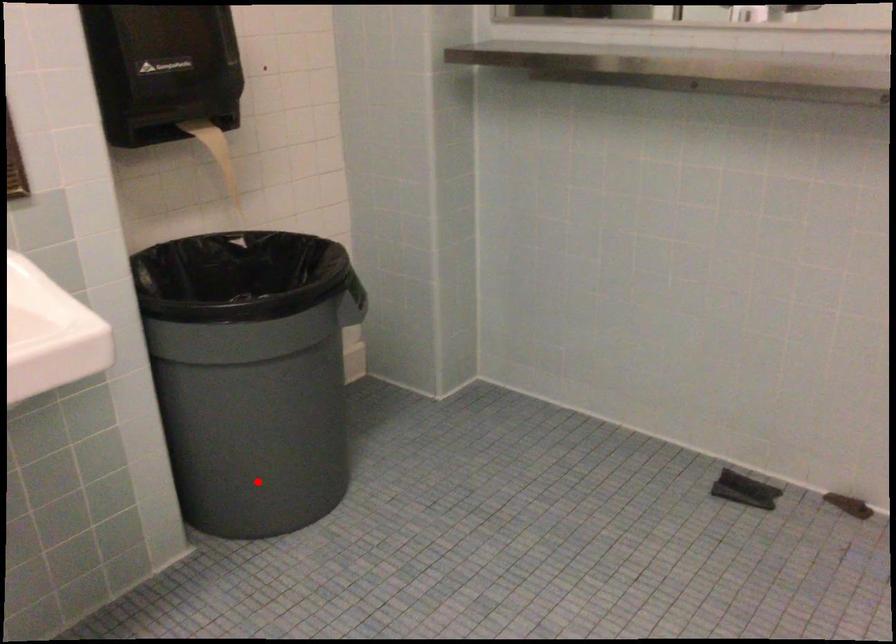
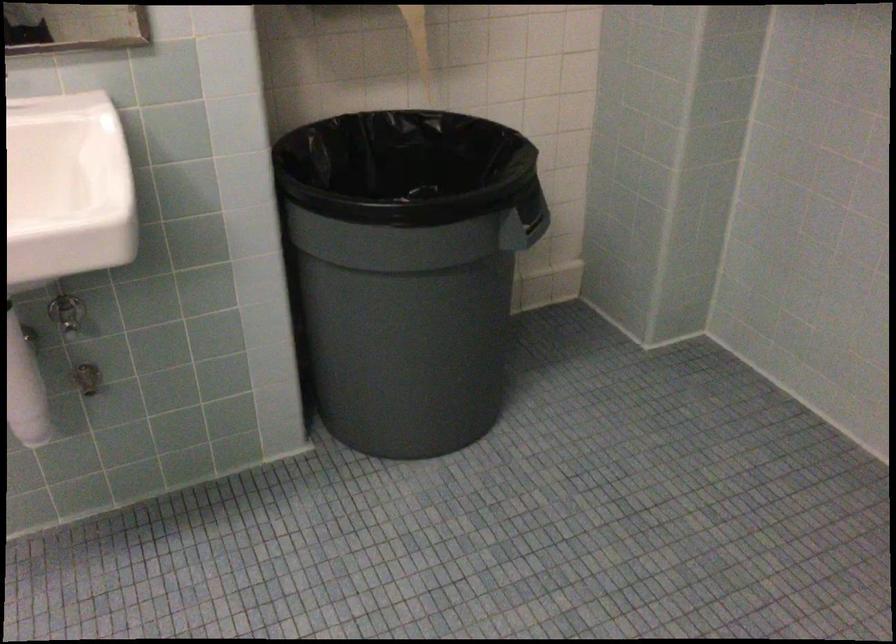
The point at the highlighted location is marked in the first image. Where is the corresponding point in the second image?

(382, 395)